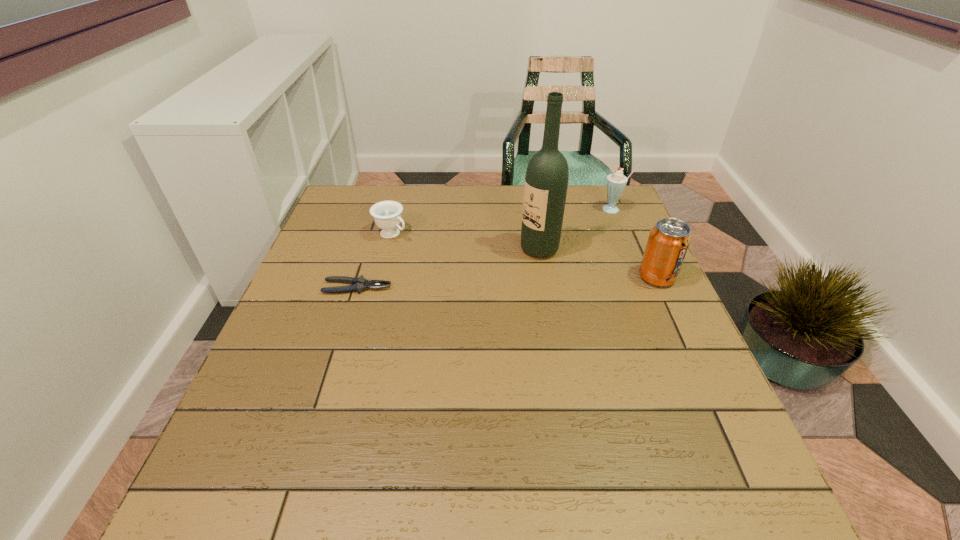
This screenshot has height=540, width=960. Find the location of `vacant space situated 0.110m on the straw side of the milkshake`. vacant space situated 0.110m on the straw side of the milkshake is located at coordinates (591, 230).

The image size is (960, 540). What are the coordinates of `free space located 0.390m on the side of the fourth tallest object with the handle` in the screenshot? It's located at (512, 307).

Where is `vacant space located on the side of the fourth tallest object with the handle`? The image size is (960, 540). vacant space located on the side of the fourth tallest object with the handle is located at coordinates (480, 288).

Where is `free space located on the side of the fourth tallest object with the handle`? The image size is (960, 540). free space located on the side of the fourth tallest object with the handle is located at coordinates (444, 265).

Identify the location of vacant region located on the labeled side of the tallest object. (455, 303).

Find the location of a particular element. Image resolution: width=960 pixels, height=540 pixels. free space located on the labeled side of the tallest object is located at coordinates (489, 281).

You are a GUI agent. You are given a task and a screenshot of the screen. Output one action in this format:
    pyautogui.click(x=<x>, y=<y>)
    Task: Click on the vacant space situated on the labeled side of the tallest object
    
    Given the screenshot: What is the action you would take?
    pyautogui.click(x=511, y=267)

What are the coordinates of `milkshake that is at the far edge` in the screenshot? It's located at (615, 183).

The width and height of the screenshot is (960, 540). I want to click on teacup present at the far edge, so click(x=387, y=214).

In order to click on pliers present at the left edge in this screenshot , I will do `click(359, 284)`.